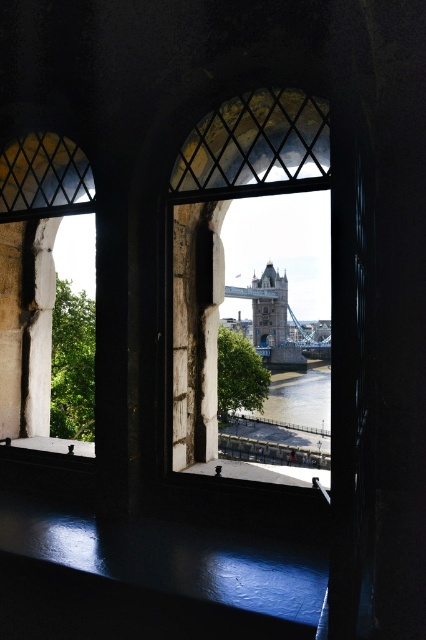
You are an architect designing a new building and want to ensure the clear glass window at center provides a full view of the blue stone tower bridge at center. Based on the scene, is the window wide enough to frame the bridge without cropping its sides?

The clear glass window at center might be wider than blue stone tower bridge at center, so it is likely wide enough to frame the bridge without cropping its sides.